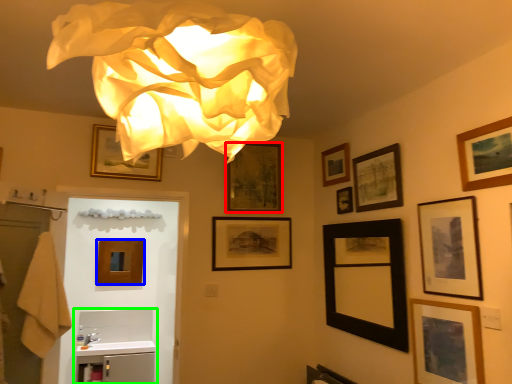
Question: Which object is the closest to the picture frame (highlighted by a red box)? Choose among these: picture frame (highlighted by a blue box) or sink (highlighted by a green box).

Choices:
 (A) picture frame
 (B) sink

Answer: (A)